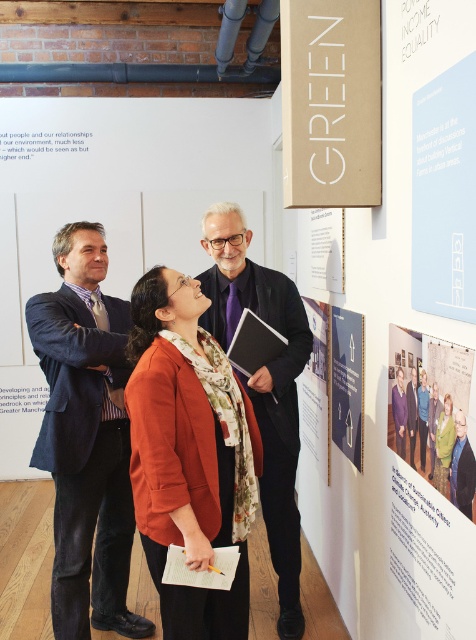
You are standing in the room and see three people. The person on the left is wearing a dark suit jacket over a striped shirt and a light tie, the person in the center has a dark suit jacket with a patterned scarf and a darker tie, and the person on the right is in a red blazer with a white shirt. There is a point marked at coordinates (264, 385). Which person is this point located on?

The point marked at coordinates (264, 385) is located on the purple floral shirt at center.

You are an attendee at an event and notice two items at the center of the scene. The purple floral shirt at center and the matte paper poster at center. Which one is lower in the image?

The purple floral shirt at center is positioned under the matte paper poster at center, so the purple floral shirt at center is lower.

You are an event planner trying to set up a microphone for a presentation. The purple floral shirt at center and the matte paper poster at center are both in the center of the room. Which one is closer to you as you approach from the front of the room?

The purple floral shirt at center is closer to you than the matte paper poster at center because the matte paper poster at center is behind the purple floral shirt at center.